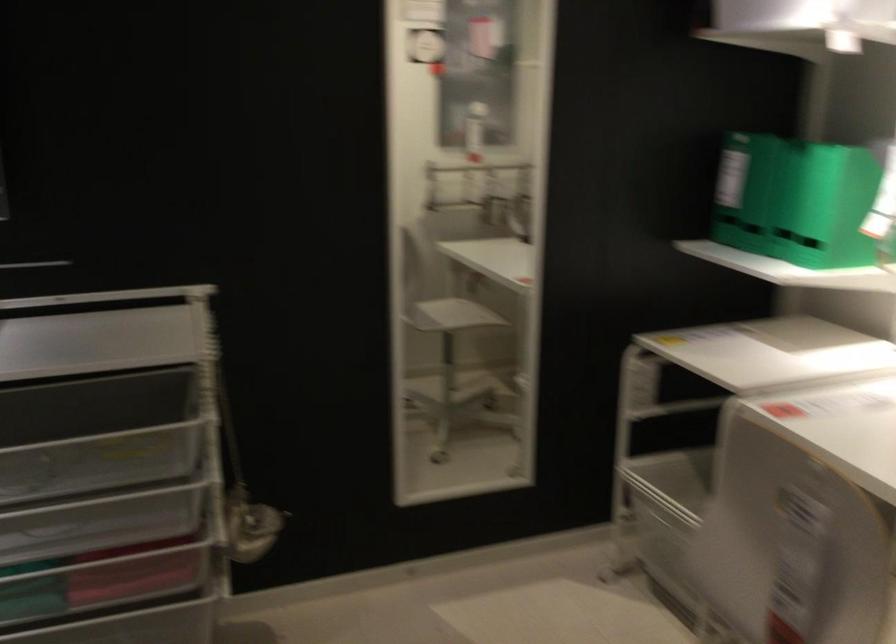
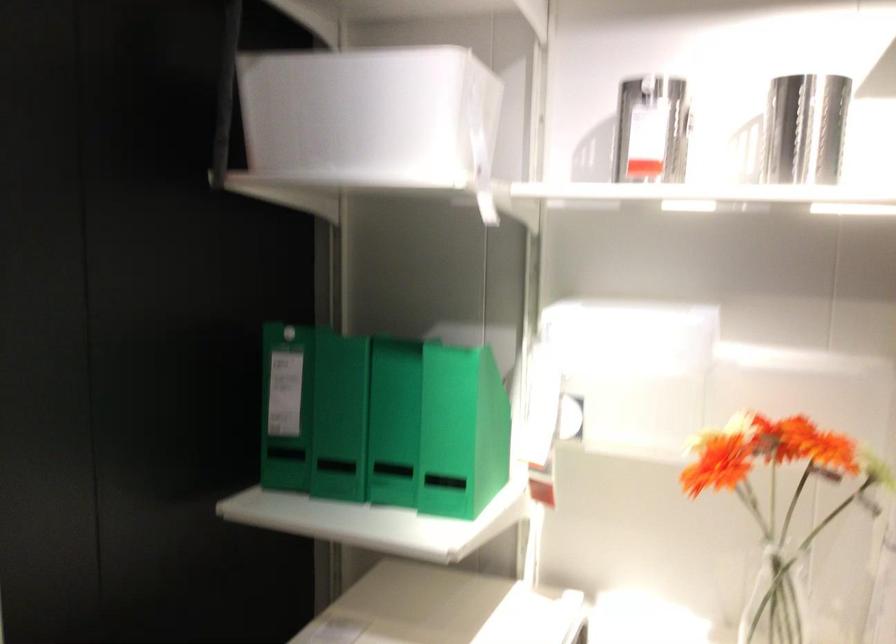
Find the pixel in the second image that matches point (779, 198) in the first image.

(392, 422)